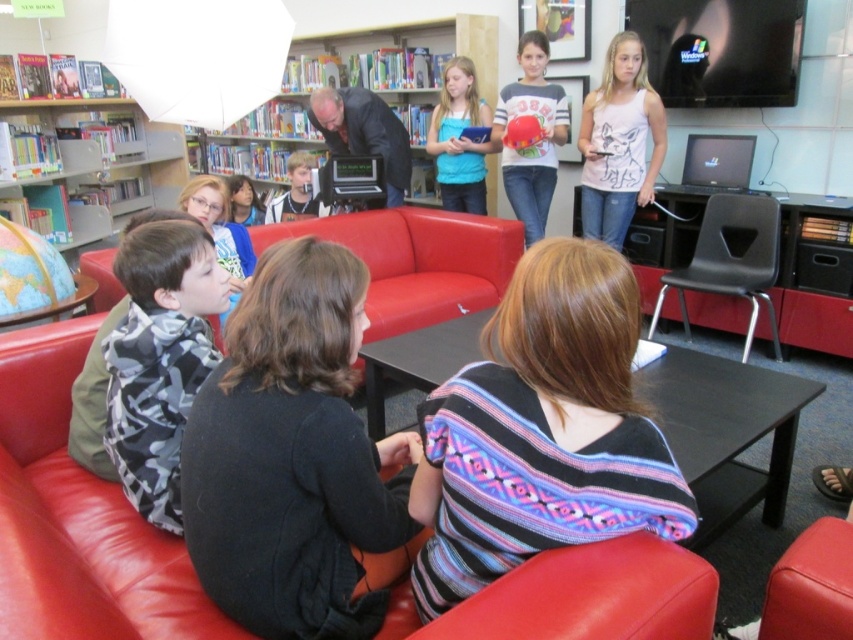
Question: Is the position of striped knit sweater at center less distant than that of smooth black shirt at center?

Choices:
 (A) yes
 (B) no

Answer: (A)

Question: Which object appears farthest from the camera in this image?

Choices:
 (A) light brown hair at center
 (B) camouflage jacket at center

Answer: (B)

Question: Does black wool sweater at center have a smaller size compared to white tank top at upper right?

Choices:
 (A) yes
 (B) no

Answer: (A)

Question: Is leather couch at center to the right of camouflage jacket at center from the viewer's perspective?

Choices:
 (A) no
 (B) yes

Answer: (B)

Question: Which point is closer to the camera?

Choices:
 (A) leather couch at center
 (B) blue fabric shirt at center
 (C) white tank top at upper right
 (D) wooden bookshelf at left

Answer: (A)

Question: Which point is farther to the camera?

Choices:
 (A) (332, 113)
 (B) (476, 72)
 (C) (628, 109)
 (D) (161, 195)

Answer: (D)